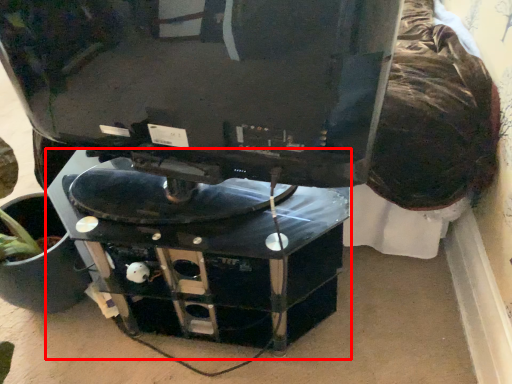
Question: From the image's perspective, where is computer desk (annotated by the red box) located in relation to computer monitor in the image?

Choices:
 (A) below
 (B) above

Answer: (A)